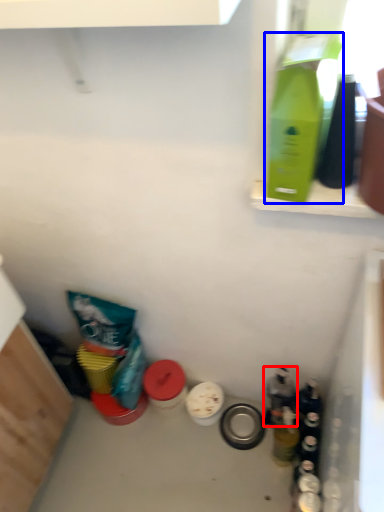
Question: Which of the following is the farthest to the observer, bottle (highlighted by a red box) or bottle (highlighted by a blue box)?

Choices:
 (A) bottle
 (B) bottle

Answer: (A)